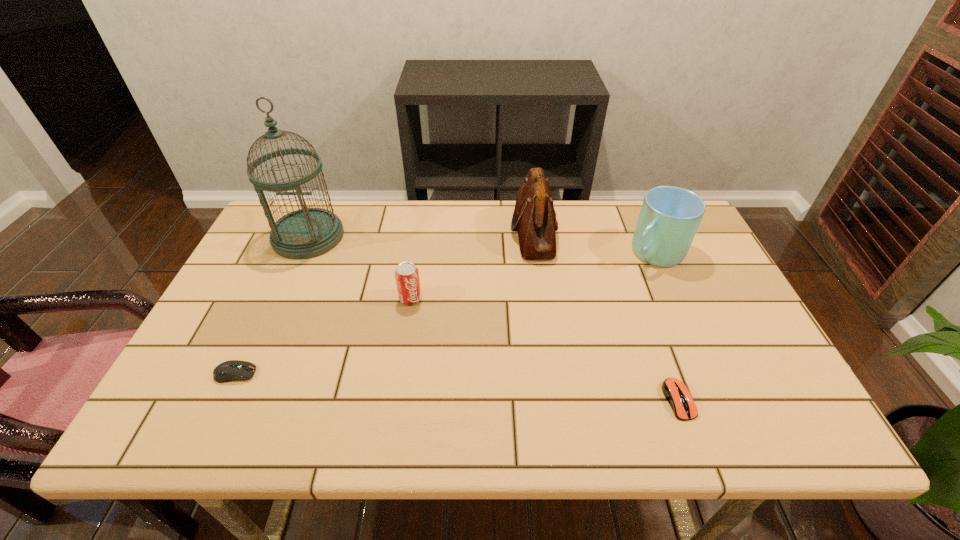
The height and width of the screenshot is (540, 960). Find the location of `object that is the closest to the left computer mouse`. object that is the closest to the left computer mouse is located at coordinates (407, 279).

In order to click on vacant area that satisfies the following two spatial constraints: 1. on the front-facing side of the tallest object; 2. on the button of the left computer mouse in this screenshot , I will do `click(248, 374)`.

You are a GUI agent. You are given a task and a screenshot of the screen. Output one action in this format:
    pyautogui.click(x=<x>, y=<y>)
    Task: Click on the free space that satisfies the following two spatial constraints: 1. on the back side of the shorter computer mouse; 2. on the left side of the fourth shortest object
    The height and width of the screenshot is (540, 960).
    Given the screenshot: What is the action you would take?
    pyautogui.click(x=625, y=253)

At what (x,y) coordinates should I click in order to perform the action: click on free space that satisfies the following two spatial constraints: 1. on the front side of the third nearest object; 2. on the button of the left computer mouse. Please return your answer as a coordinate pair (x, y). Image resolution: width=960 pixels, height=540 pixels. Looking at the image, I should click on coord(398,374).

Locate an element on the screen. This screenshot has height=540, width=960. blank area in the image that satisfies the following two spatial constraints: 1. on the front-facing side of the right computer mouse; 2. on the right side of the birdcage is located at coordinates (235, 400).

Locate an element on the screen. The height and width of the screenshot is (540, 960). free region that satisfies the following two spatial constraints: 1. on the front-facing side of the tallest object; 2. on the button of the left computer mouse is located at coordinates (248, 374).

Where is `free region that satisfies the following two spatial constraints: 1. on the button of the right computer mouse; 2. on the left side of the left computer mouse`? The width and height of the screenshot is (960, 540). free region that satisfies the following two spatial constraints: 1. on the button of the right computer mouse; 2. on the left side of the left computer mouse is located at coordinates (223, 400).

Find the location of a particular element. Image resolution: width=960 pixels, height=540 pixels. free space that satisfies the following two spatial constraints: 1. on the back side of the fourth tallest object; 2. on the left side of the shoulder bag is located at coordinates (420, 232).